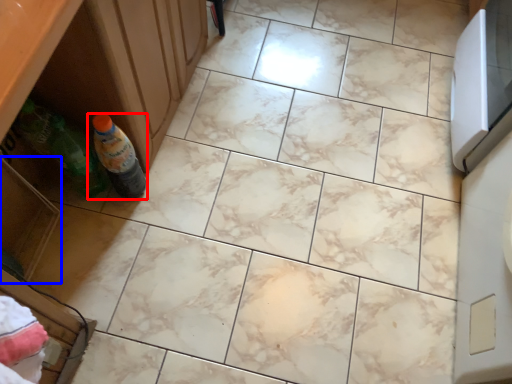
Question: Which point is further to the camera, bottle (highlighted by a red box) or drawer (highlighted by a blue box)?

Choices:
 (A) bottle
 (B) drawer

Answer: (A)